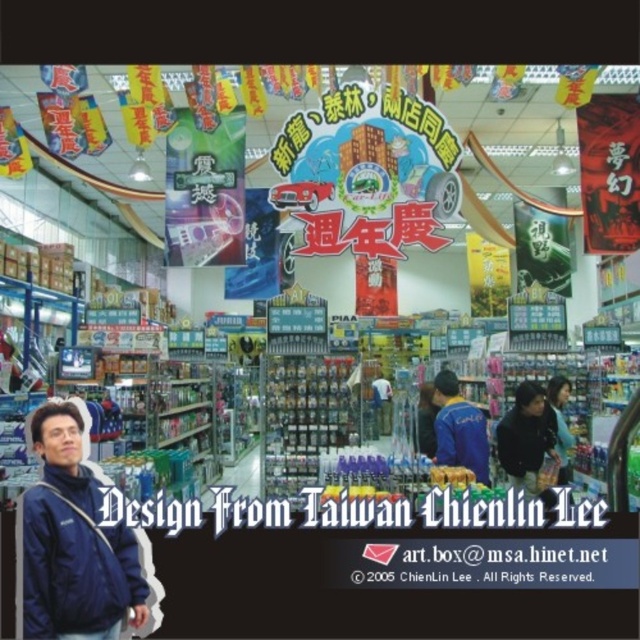
You are a customer in the store and want to pick up both the dark blue jacket at center and the blue fabric jacket at center. Which one should you reach for first?

You should reach for the dark blue jacket at center first because it is closer to you than the blue fabric jacket at center.

You are a customer in the store and want to reach the blue fabric jacket at lower left and the dark blue jacket at center. Which jacket is taller?

The blue fabric jacket at lower left is taller than the dark blue jacket at center.